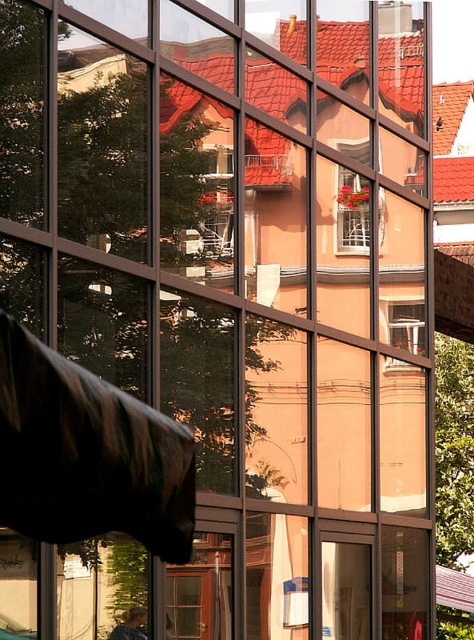
You are an architect designing a new building. You want to ensure that the clear glass window at center and the white wooden window at center are arranged in a way that the lower window does not block the view of the upper one. Based on the scene provided, which window should be placed higher to maintain an unobstructed view?

The clear glass window at center is below the white wooden window at center. To maintain an unobstructed view, the white wooden window at center should be placed higher so that the clear glass window at center remains below it and does not block the view.

You are standing in front of the modern building and want to take a photo of the point at coordinates (x=401, y=323). The camera you are using has a focal length of 50mm and a sensor size of 24mm x 36mm. If the distance between you and the point is 16.45 meters, what is the angle of view required to capture the point in the frame?

The angle of view required to capture the point at coordinates (x=401, y=323) is determined by the camera specifications. Using the formula for angle of view, which is 2 arctan, the distance to the subject divided by twice the focal length. Plugging in the values, the angle of view would be 2 arctan, 16.45 meters divided by 2 times 50mm. However, since the sensor size and focal length are provided, the horizontal angle of view can be calculated as 2 times arctangent of half the sensor width divided by focal.

You are standing in front of the modern building and want to look through the clear glass window at center to see the residential area. However, there is also a white wooden window at center in your view. Which window should you look through to see the reflection of the houses with red tiled roofs?

You should look through the clear glass window at center because the white wooden window at center is behind it, so the reflection of the houses with red tiled roofs would be visible through the clear glass window at center.